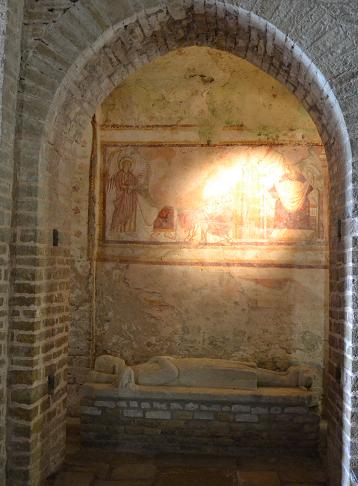
Where is `painting`? The image size is (358, 486). painting is located at coordinates (216, 197).